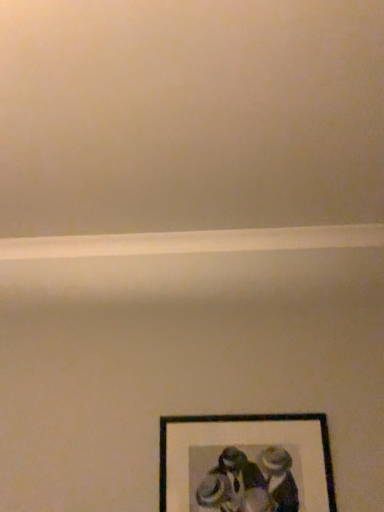
Image resolution: width=384 pixels, height=512 pixels. I want to click on black matte picture frame at lower center, so click(x=246, y=464).

The height and width of the screenshot is (512, 384). Describe the element at coordinates (246, 464) in the screenshot. I see `black matte picture frame at lower center` at that location.

Identify the location of black matte picture frame at lower center. The width and height of the screenshot is (384, 512). (246, 464).